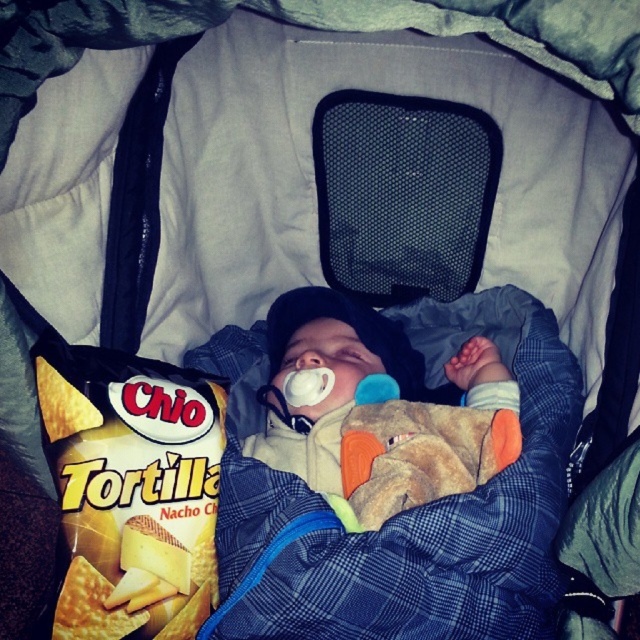
Question: Can you confirm if soft plush toy at center is positioned below blue rubber teething ring at upper center?

Choices:
 (A) yes
 (B) no

Answer: (B)

Question: Which of the following is the closest to the observer?

Choices:
 (A) (388, 440)
 (B) (339, 483)
 (C) (83, 532)

Answer: (C)

Question: Based on their relative distances, which object is nearer to the yellow tortilla chips at lower left?

Choices:
 (A) soft plush toy at center
 (B) blue rubber teething ring at upper center

Answer: (A)

Question: Does yellow tortilla chips at lower left appear on the right side of blue rubber teething ring at upper center?

Choices:
 (A) no
 (B) yes

Answer: (A)

Question: Which of these objects is positioned farthest from the yellow tortilla chips at lower left?

Choices:
 (A) soft plush toy at center
 (B) blue rubber teething ring at upper center

Answer: (B)

Question: Can you confirm if soft plush toy at center is positioned to the right of blue rubber teething ring at upper center?

Choices:
 (A) yes
 (B) no

Answer: (B)